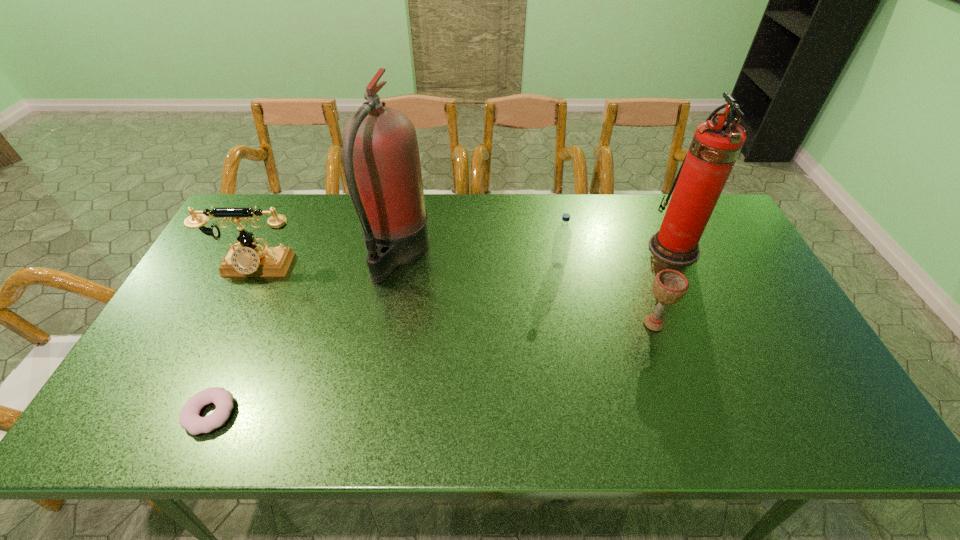
The width and height of the screenshot is (960, 540). What are the coordinates of `vacant region that satisfies the following two spatial constraints: 1. on the dial of the telephone; 2. on the left side of the fifth object from left to right` in the screenshot? It's located at (228, 323).

Find the location of a particular element. The image size is (960, 540). vacant space that satisfies the following two spatial constraints: 1. on the front side of the fifth farthest object; 2. on the left side of the third object from right to left is located at coordinates (568, 323).